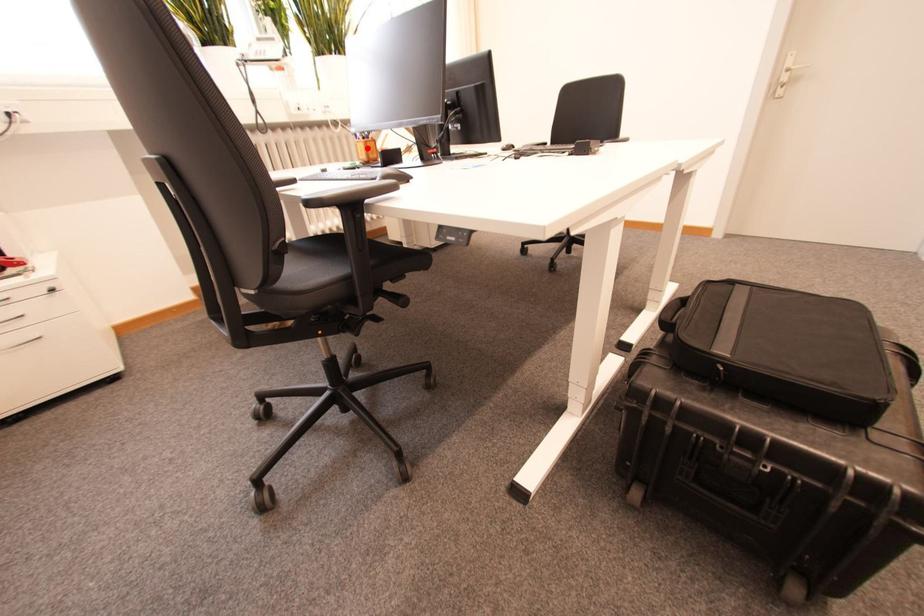
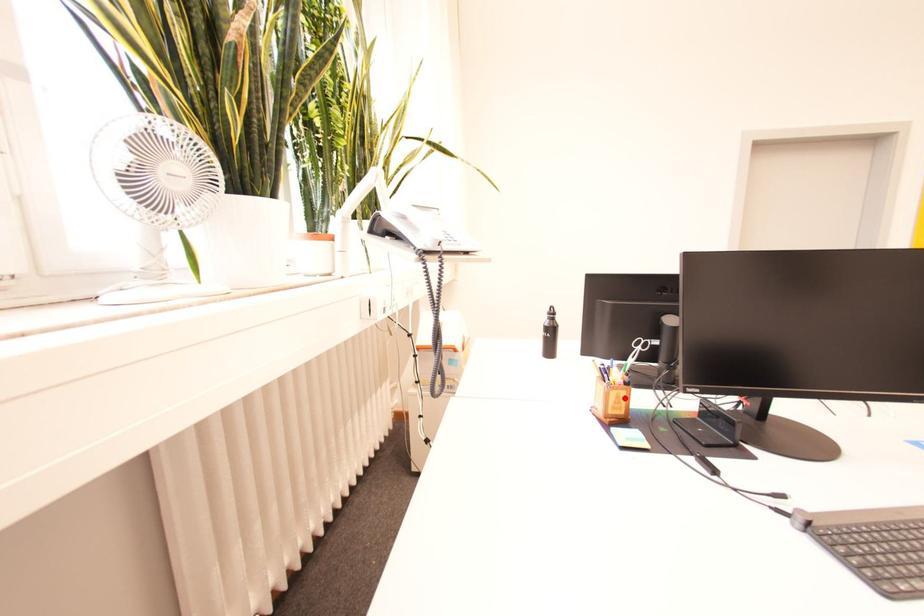
In the scene shown: I am providing you with two images of the same scene from different viewpoints. A red point is marked on the first image and another point is marked on the second image. Is the marked point in image1 the same physical position as the marked point in image2?

Yes